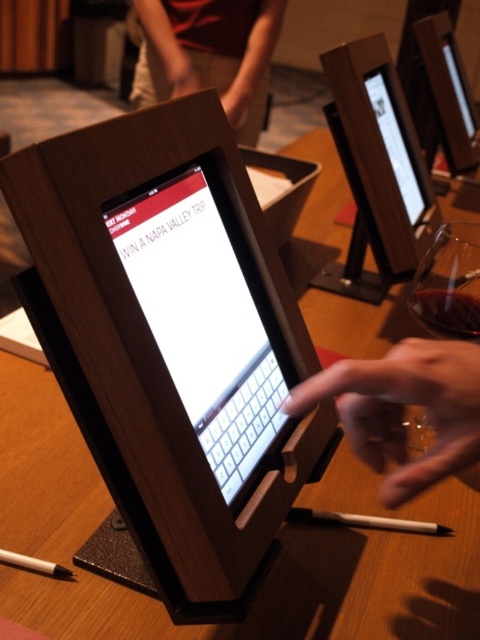
Who is higher up, transparent glass at center or white plastic pen at lower center?

transparent glass at center is above.

Which of these two, transparent glass at center or white plastic pen at lower center, stands shorter?

Standing shorter between the two is white plastic pen at lower center.

What do you see at coordinates (446, 310) in the screenshot? Image resolution: width=480 pixels, height=640 pixels. I see `transparent glass at center` at bounding box center [446, 310].

You are a GUI agent. You are given a task and a screenshot of the screen. Output one action in this format:
    pyautogui.click(x=<x>, y=<y>)
    Task: Click on the transparent glass at center
    
    Given the screenshot: What is the action you would take?
    pyautogui.click(x=446, y=310)

Can you confirm if matte black tablet at center is positioned below white matte pencil at lower left?

No, matte black tablet at center is not below white matte pencil at lower left.

What do you see at coordinates (206, 312) in the screenshot? I see `matte black tablet at center` at bounding box center [206, 312].

At what (x,y) coordinates should I click in order to perform the action: click on matte black tablet at center. Please return your answer as a coordinate pair (x, y). Looking at the image, I should click on (206, 312).

Does transparent glass at center have a greater height compared to white matte pencil at lower left?

Correct, transparent glass at center is much taller as white matte pencil at lower left.

I want to click on transparent glass at center, so click(x=446, y=310).